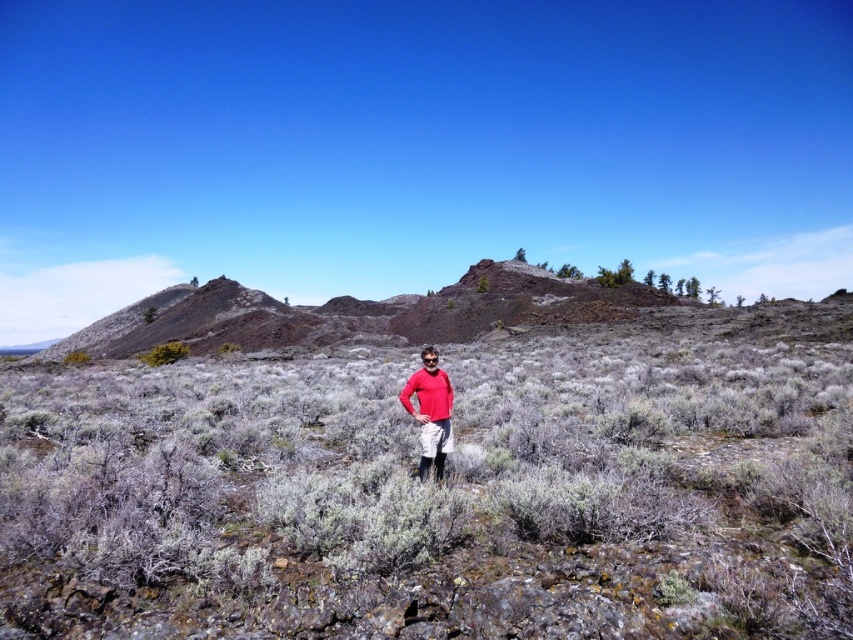
Image resolution: width=853 pixels, height=640 pixels. What are the coordinates of `matte red shirt at center` in the screenshot? It's located at (430, 412).

Does matte red shirt at center have a lesser height compared to green shrub at left?

Incorrect, matte red shirt at center's height does not fall short of green shrub at left's.

Image resolution: width=853 pixels, height=640 pixels. I want to click on matte red shirt at center, so click(430, 412).